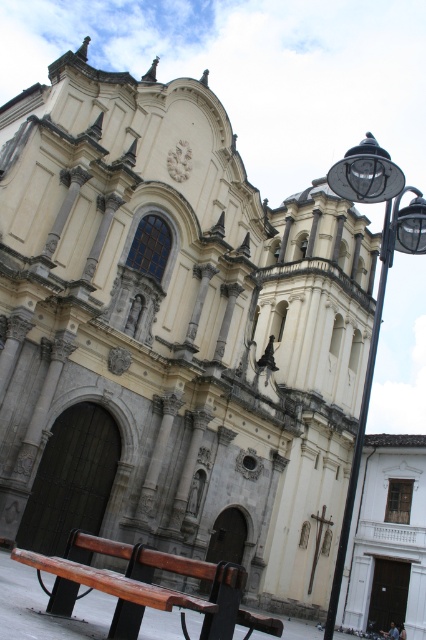
Question: Is wooden bench at lower left smaller than black metal streetlight at right?

Choices:
 (A) no
 (B) yes

Answer: (B)

Question: Which point is farther to the camera?

Choices:
 (A) black metal streetlight at right
 (B) wooden bench at lower left

Answer: (A)

Question: Considering the relative positions of wooden bench at lower left and black metal streetlight at right in the image provided, where is wooden bench at lower left located with respect to black metal streetlight at right?

Choices:
 (A) left
 (B) right

Answer: (A)

Question: Which point is farther to the camera?

Choices:
 (A) wooden bench at lower left
 (B) black metal streetlight at right

Answer: (B)

Question: From the image, what is the correct spatial relationship of wooden bench at lower left in relation to black metal streetlight at right?

Choices:
 (A) above
 (B) below

Answer: (B)